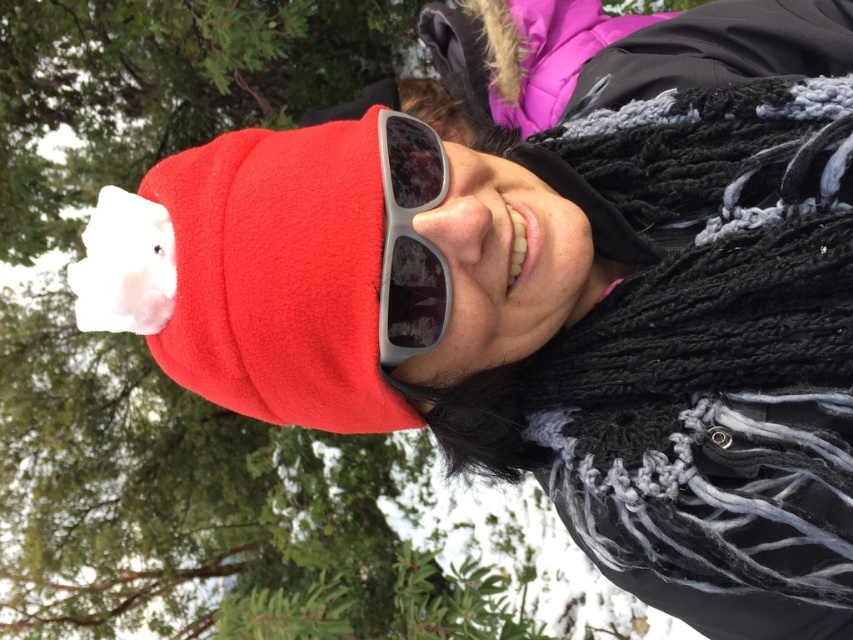
Is point (741, 557) behind point (431, 259)?

No, (741, 557) is in front of (431, 259).

From the picture: Which is above, black knitted scarf at right or gray matte sunglasses at center?

gray matte sunglasses at center

The width and height of the screenshot is (853, 640). What are the coordinates of `black knitted scarf at right` in the screenshot? It's located at (712, 344).

Image resolution: width=853 pixels, height=640 pixels. What are the coordinates of `black knitted scarf at right` in the screenshot? It's located at (712, 344).